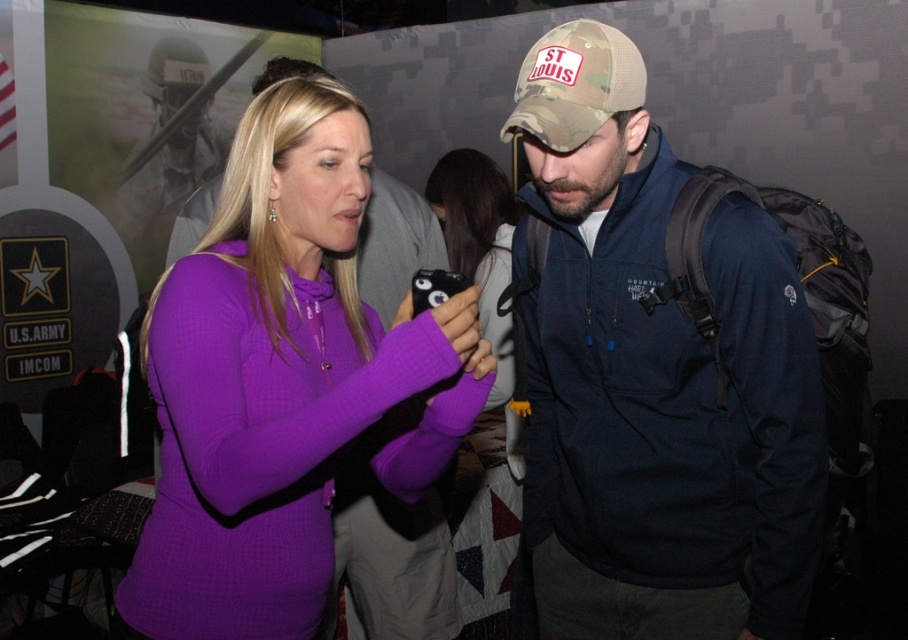
You are a photographer at the event and need to place a small flag between the camouflage fabric helmet at upper left and the camo fabric baseball cap at center. According to their positions, which object should the flag be closer to?

The camouflage fabric helmet at upper left is positioned on the left side of the camo fabric baseball cap at center, so the flag should be placed closer to the camouflage fabric helmet at upper left.

What is located at the point with coordinates (x=654, y=376) in the image?

The point at coordinates (x=654, y=376) indicates a camo fabric hat at center.